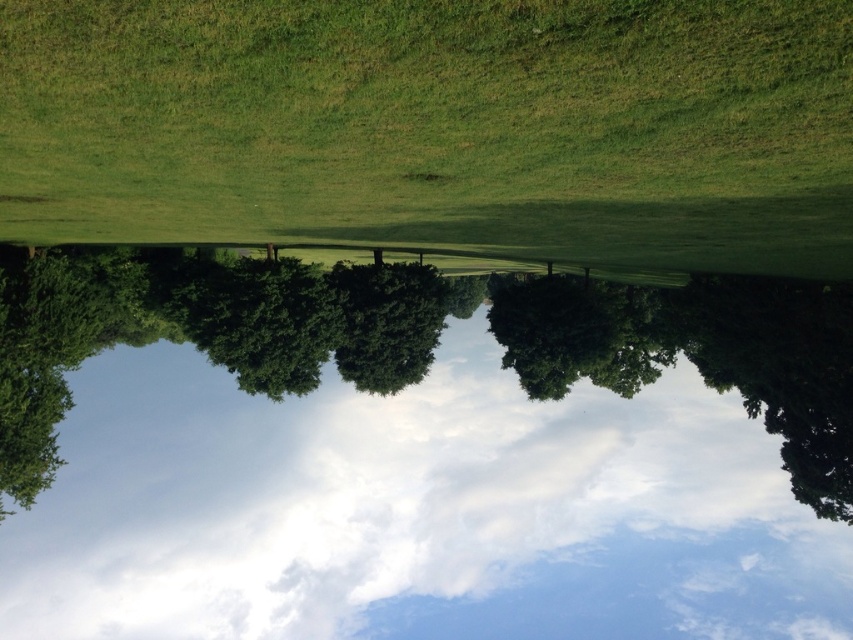
Question: Does white fluffy cloud at upper center appear under green grassy field at center?

Choices:
 (A) yes
 (B) no

Answer: (A)

Question: Does white fluffy cloud at upper center have a smaller size compared to green grassy field at center?

Choices:
 (A) no
 (B) yes

Answer: (A)

Question: Which object appears farthest from the camera in this image?

Choices:
 (A) white fluffy cloud at upper center
 (B) green grassy field at center

Answer: (A)

Question: Is white fluffy cloud at upper center below green grassy field at center?

Choices:
 (A) yes
 (B) no

Answer: (A)